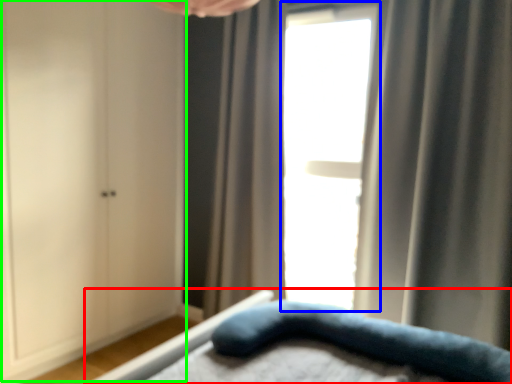
Question: Based on their relative distances, which object is farther from bed (highlighted by a red box)? Choose from window (highlighted by a blue box) and dresser (highlighted by a green box).

Choices:
 (A) window
 (B) dresser

Answer: (B)